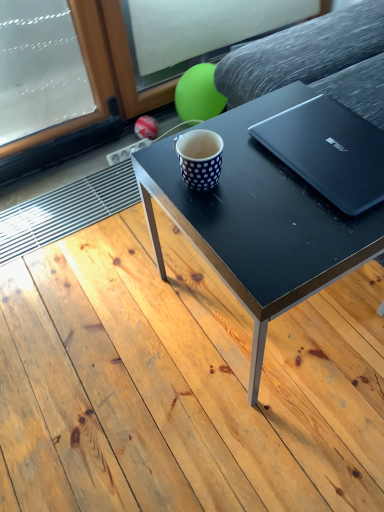
Question: Is white dotted mug at center next to black matte table at center?

Choices:
 (A) yes
 (B) no

Answer: (B)

Question: Could you tell me if white dotted mug at center is turned towards black matte table at center?

Choices:
 (A) no
 (B) yes

Answer: (A)

Question: Is the position of white dotted mug at center less distant than that of black matte table at center?

Choices:
 (A) yes
 (B) no

Answer: (B)

Question: Does white dotted mug at center have a greater width compared to black matte table at center?

Choices:
 (A) yes
 (B) no

Answer: (B)

Question: Can you confirm if white dotted mug at center is bigger than black matte table at center?

Choices:
 (A) no
 (B) yes

Answer: (A)

Question: From the image's perspective, relative to black matte coffee table at center, is white dotted mug at center above or below?

Choices:
 (A) below
 (B) above

Answer: (B)

Question: Is point (183, 165) closer or farther from the camera than point (299, 94)?

Choices:
 (A) closer
 (B) farther

Answer: (A)

Question: Choose the correct answer: Is white dotted mug at center inside black matte coffee table at center or outside it?

Choices:
 (A) outside
 (B) inside

Answer: (A)

Question: Considering the positions of white dotted mug at center and black matte coffee table at center in the image, is white dotted mug at center bigger or smaller than black matte coffee table at center?

Choices:
 (A) small
 (B) big

Answer: (A)

Question: In terms of width, does white dotted mug at center look wider or thinner when compared to black matte laptop at upper right?

Choices:
 (A) wide
 (B) thin

Answer: (B)

Question: Relative to black matte laptop at upper right, is white dotted mug at center in front or behind?

Choices:
 (A) behind
 (B) front

Answer: (A)

Question: From the image's perspective, is white dotted mug at center located above or below black matte laptop at upper right?

Choices:
 (A) above
 (B) below

Answer: (B)

Question: Is white dotted mug at center situated inside black matte laptop at upper right or outside?

Choices:
 (A) outside
 (B) inside

Answer: (A)

Question: From the image's perspective, is black matte table at center positioned above or below black matte coffee table at center?

Choices:
 (A) above
 (B) below

Answer: (B)

Question: Is black matte table at center bigger or smaller than black matte coffee table at center?

Choices:
 (A) big
 (B) small

Answer: (A)